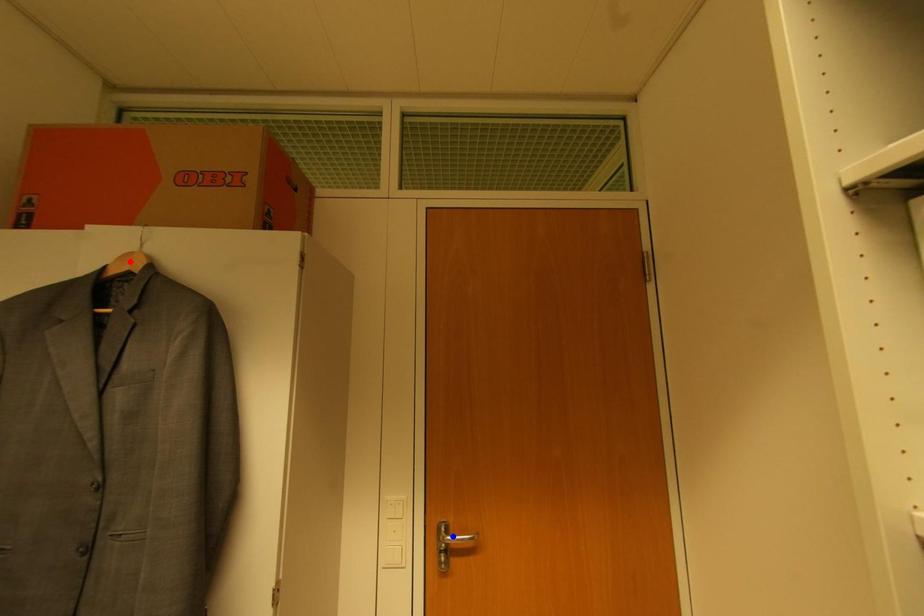
Question: Which of the two points in the image is closer to the camera?

Choices:
 (A) Blue point is closer.
 (B) Red point is closer.

Answer: (B)